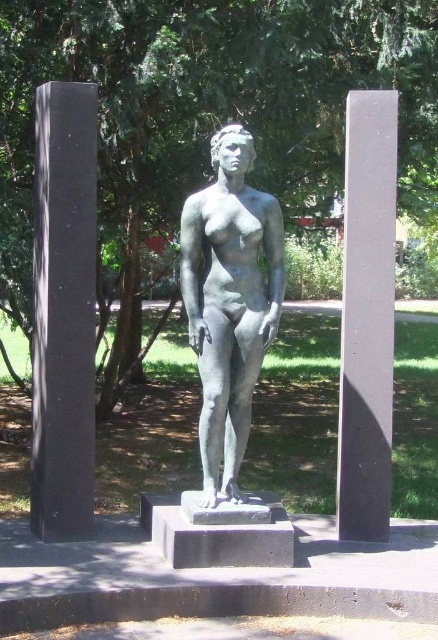
Question: Estimate the real-world distances between objects in this image. Which object is farther from the polished bronze statue at center?

Choices:
 (A) black polished stone pillar at left
 (B) smooth gray pillar at right

Answer: (A)

Question: Which of the following is the farthest from the observer?

Choices:
 (A) polished bronze statue at center
 (B) smooth gray pillar at right
 (C) black polished stone pillar at left

Answer: (B)

Question: Is polished bronze statue at center further to camera compared to smooth gray pillar at right?

Choices:
 (A) no
 (B) yes

Answer: (A)

Question: Does black polished stone pillar at left have a lesser width compared to smooth gray pillar at right?

Choices:
 (A) yes
 (B) no

Answer: (B)

Question: Is the position of black polished stone pillar at left less distant than that of smooth gray pillar at right?

Choices:
 (A) yes
 (B) no

Answer: (A)

Question: Which point is farther to the camera?

Choices:
 (A) black polished stone pillar at left
 (B) smooth gray pillar at right
 (C) polished bronze statue at center

Answer: (B)